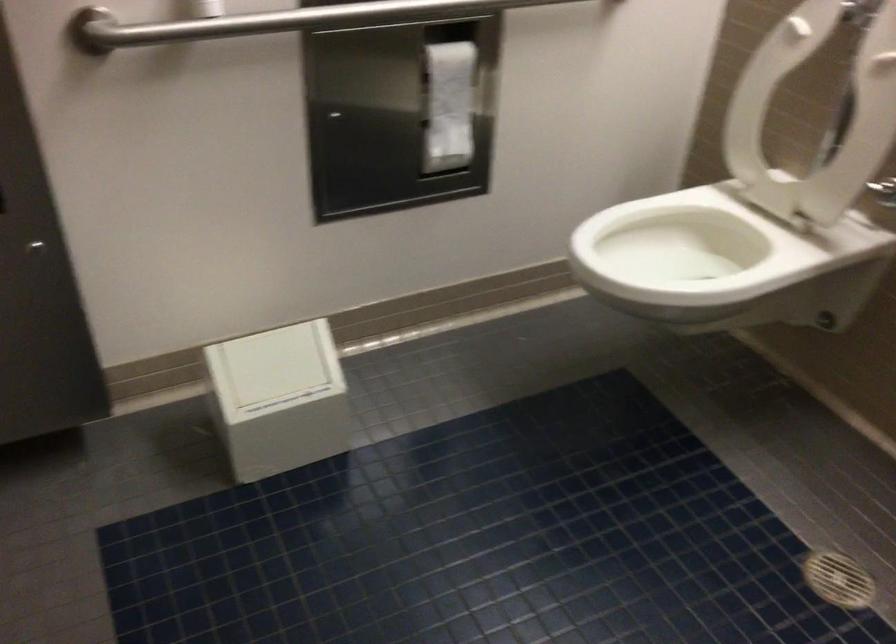
Where would you lift the white toilet seat? Please return your answer as a coordinate pair (x, y).

(684, 245)